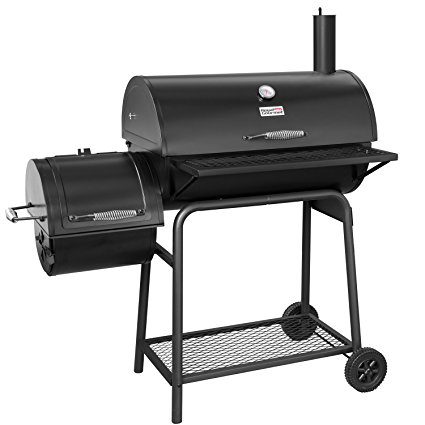
Locate an element on the screen. The width and height of the screenshot is (425, 425). metal rack is located at coordinates (274, 159).